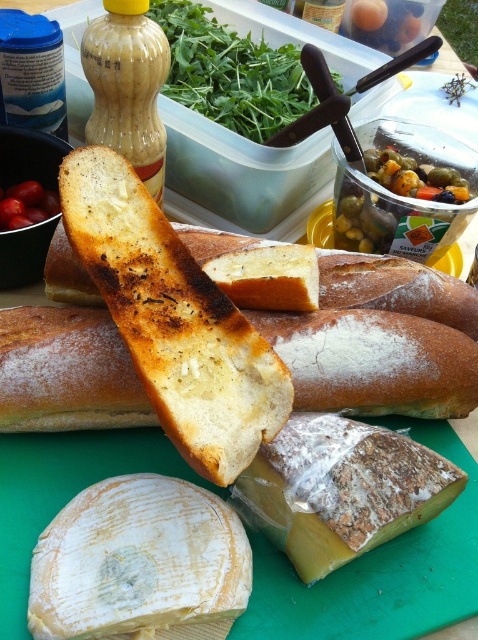
You are setting up a picnic and want to place the yellow wax cheese at center and the green leafy vegetable at upper center on a platter. Based on their positions in the image, which item should you pick up first to avoid covering the other?

The yellow wax cheese at center is in front of the green leafy vegetable at upper center, so you should pick up the green leafy vegetable at upper center first to avoid covering it when placing the cheese on top.

You are planning to place a small decorative plate at the center of the image. There is a point marked at coordinates point (340, 490). Is this point located on the yellow wax cheese at center?

Yes, the point (340, 490) is located on the yellow wax cheese at center as per the provided coordinates.

You are packing a picnic basket and need to know which item is narrower between the white crumbly cheese at center and the green olive at upper right. Which one should you choose?

The white crumbly cheese at center has a lesser width compared to the green olive at upper right, so you should choose the white crumbly cheese at center as it is narrower.